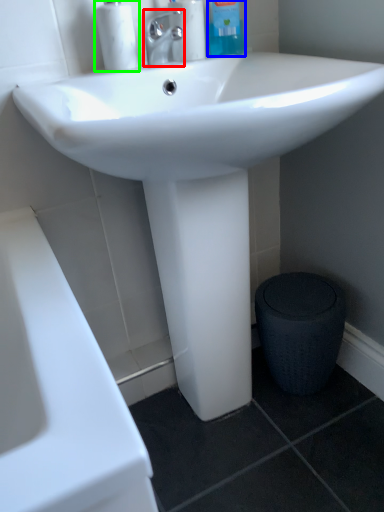
Question: Based on their relative distances, which object is nearer to tap (highlighted by a red box)? Choose from cleaning product (highlighted by a blue box) and soap dispenser (highlighted by a green box).

Choices:
 (A) cleaning product
 (B) soap dispenser

Answer: (B)